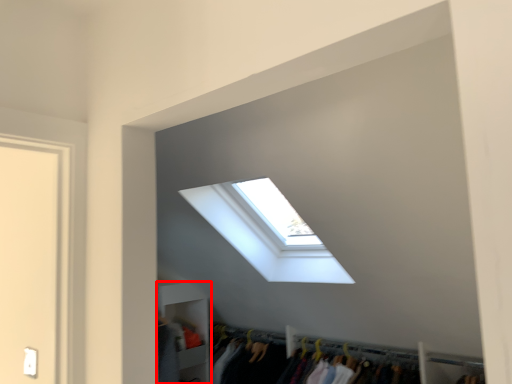
Question: From the image's perspective, considering the relative positions of shelf (annotated by the red box) and window in the image provided, where is shelf (annotated by the red box) located with respect to the staircase?

Choices:
 (A) above
 (B) below

Answer: (B)